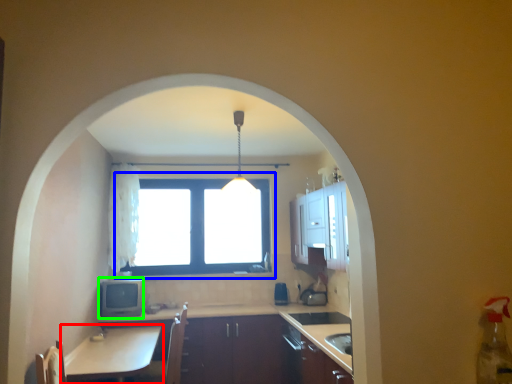
Question: Estimate the real-world distances between objects in this image. Which object is farther from table (highlighted by a red box), window (highlighted by a blue box) or appliance (highlighted by a green box)?

Choices:
 (A) window
 (B) appliance

Answer: (A)